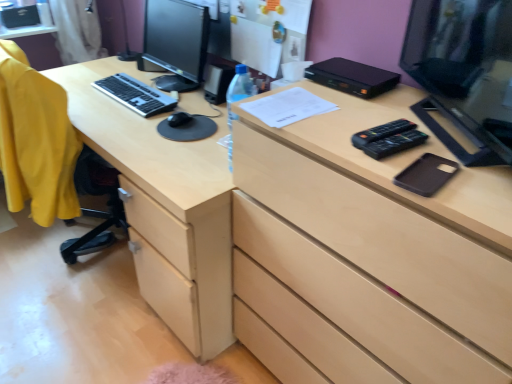
This screenshot has width=512, height=384. Find the location of `empty space that is in between black plastic printer at upper center and black matte phone case at right`. empty space that is in between black plastic printer at upper center and black matte phone case at right is located at coordinates (384, 114).